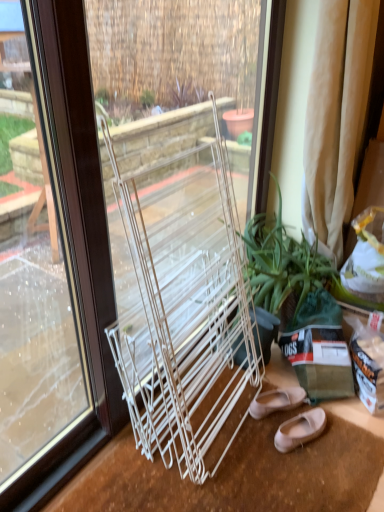
What do you see at coordinates (277, 401) in the screenshot? I see `matte beige flats at lower right, marked as the second footwear in a front-to-back arrangement` at bounding box center [277, 401].

What do you see at coordinates (75, 114) in the screenshot? I see `clear glass window at center` at bounding box center [75, 114].

What is the approximate height of beige fabric curtain at right?

It is 3.28 feet.

At what (x,y) coordinates should I click in order to perform the action: click on beige fabric curtain at right. Please return your answer as a coordinate pair (x, y). This screenshot has width=384, height=512. Looking at the image, I should click on click(337, 115).

Locate an element on the screen. matte pink leather ballet flats at lower right, the 1th footwear in the front-to-back sequence is located at coordinates (300, 429).

In order to face green leafy plant at center, should I rotate leftwards or rightwards?

Turn right approximately 11.299 degrees to face it.

This screenshot has height=512, width=384. I want to click on matte beige flats at lower right, marked as the second footwear in a front-to-back arrangement, so click(x=277, y=401).

Is clear glass window at center far from matte beige flats at lower right, marked as the second footwear in a front-to-back arrangement?

They are positioned close to each other.

Which point is more distant from viewer, (51,90) or (282,407)?

Point (282,407)

Considering the positions of objects clear glass window at center and matte beige flats at lower right, arranged as the first footwear when viewed from the back, in the image provided, who is more to the right, clear glass window at center or matte beige flats at lower right, arranged as the first footwear when viewed from the back,?

Positioned to the right is matte beige flats at lower right, arranged as the first footwear when viewed from the back.

Image resolution: width=384 pixels, height=512 pixels. I want to click on window that appears on the left of matte beige flats at lower right, arranged as the first footwear when viewed from the back, so click(75, 114).

From a real-world perspective, between green leafy plant at center and clear glass window at center, who is vertically higher?

In real-world perspective, clear glass window at center is above.

Are green leafy plant at center and clear glass window at center located far from each other?

green leafy plant at center is near clear glass window at center, not far away.

Could you tell me if green leafy plant at center is turned towards clear glass window at center?

Yes, green leafy plant at center is oriented towards clear glass window at center.

Between beige fabric curtain at right and clear glass window at center, which one has smaller size?

Smaller between the two is beige fabric curtain at right.

Consider the image. Is beige fabric curtain at right not close to clear glass window at center?

Yes, beige fabric curtain at right and clear glass window at center are located far from each other.

Is beige fabric curtain at right spatially inside clear glass window at center, or outside of it?

beige fabric curtain at right is not enclosed by clear glass window at center.

From a real-world perspective, is matte beige flats at lower right, arranged as the first footwear when viewed from the back, located higher than matte pink leather ballet flats at lower right, the 1th footwear in the front-to-back sequence?

No, from a real-world perspective, matte beige flats at lower right, arranged as the first footwear when viewed from the back, is not on top of matte pink leather ballet flats at lower right, the 1th footwear in the front-to-back sequence.

Who is more distant, matte beige flats at lower right, marked as the second footwear in a front-to-back arrangement, or matte pink leather ballet flats at lower right, the 1th footwear in the front-to-back sequence?

matte beige flats at lower right, marked as the second footwear in a front-to-back arrangement, is further away from the camera.

Between matte beige flats at lower right, arranged as the first footwear when viewed from the back, and matte pink leather ballet flats at lower right, the 1th footwear in the front-to-back sequence, which one has larger width?

With larger width is matte pink leather ballet flats at lower right, the 1th footwear in the front-to-back sequence.

From the image's perspective, is matte beige flats at lower right, marked as the second footwear in a front-to-back arrangement, positioned above or below matte pink leather ballet flats at lower right, arranged as the second footwear when viewed from the back?

Clearly, from the image's perspective, matte beige flats at lower right, marked as the second footwear in a front-to-back arrangement, is above matte pink leather ballet flats at lower right, arranged as the second footwear when viewed from the back.

Which is correct: green leafy plant at center is inside beige fabric curtain at right, or outside of it?

green leafy plant at center is not enclosed by beige fabric curtain at right.

Is green leafy plant at center facing away from beige fabric curtain at right?

No, beige fabric curtain at right is not at the back of green leafy plant at center.

Based on their positions, is green leafy plant at center located to the left or right of beige fabric curtain at right?

green leafy plant at center is to the left of beige fabric curtain at right.

From the picture: Considering the relative positions of beige fabric curtain at right and matte pink leather ballet flats at lower right, arranged as the second footwear when viewed from the back, in the image provided, is beige fabric curtain at right to the right of matte pink leather ballet flats at lower right, arranged as the second footwear when viewed from the back, from the viewer's perspective?

Yes, beige fabric curtain at right is to the right of matte pink leather ballet flats at lower right, arranged as the second footwear when viewed from the back.

From the image's perspective, who appears lower, beige fabric curtain at right or matte pink leather ballet flats at lower right, the 1th footwear in the front-to-back sequence?

matte pink leather ballet flats at lower right, the 1th footwear in the front-to-back sequence, appears lower in the image.

Is beige fabric curtain at right positioned far away from matte pink leather ballet flats at lower right, the 1th footwear in the front-to-back sequence?

Absolutely, beige fabric curtain at right is distant from matte pink leather ballet flats at lower right, the 1th footwear in the front-to-back sequence.

Considering the positions of point (308, 181) and point (317, 408), is point (308, 181) closer or farther from the camera than point (317, 408)?

Point (308, 181) appears to be farther away from the viewer than point (317, 408).

From the image's perspective, which one is positioned lower, clear glass window at center or green leafy plant at center?

green leafy plant at center is shown below in the image.

Is clear glass window at center at the right side of green leafy plant at center?

No, clear glass window at center is not to the right of green leafy plant at center.

Looking at their sizes, would you say clear glass window at center is wider or thinner than green leafy plant at center?

In the image, clear glass window at center appears to be more narrow than green leafy plant at center.

Identify the location of the 2nd footwear behind when counting from the clear glass window at center. (277, 401).

The image size is (384, 512). What are the coordinates of `window in front of the green leafy plant at center` in the screenshot? It's located at (75, 114).

Considering their positions, is matte pink leather ballet flats at lower right, the 1th footwear in the front-to-back sequence, positioned closer to green leafy plant at center than clear glass window at center?

matte pink leather ballet flats at lower right, the 1th footwear in the front-to-back sequence.

Considering their positions, is beige fabric curtain at right positioned closer to clear glass window at center than matte beige flats at lower right, arranged as the first footwear when viewed from the back?

Among the two, matte beige flats at lower right, arranged as the first footwear when viewed from the back, is located nearer to clear glass window at center.

When comparing their distances from green leafy plant at center, does matte pink leather ballet flats at lower right, the 1th footwear in the front-to-back sequence, or matte beige flats at lower right, arranged as the first footwear when viewed from the back, seem further?

Based on the image, matte pink leather ballet flats at lower right, the 1th footwear in the front-to-back sequence, appears to be further to green leafy plant at center.

Consider the image. Considering their positions, is green leafy plant at center positioned closer to clear glass window at center than beige fabric curtain at right?

green leafy plant at center is closer to clear glass window at center.

Based on their spatial positions, is matte beige flats at lower right, arranged as the first footwear when viewed from the back, or green leafy plant at center closer to beige fabric curtain at right?

green leafy plant at center is positioned closer to the anchor beige fabric curtain at right.

Considering their positions, is green leafy plant at center positioned further to matte pink leather ballet flats at lower right, the 1th footwear in the front-to-back sequence, than matte beige flats at lower right, marked as the second footwear in a front-to-back arrangement?

green leafy plant at center.

Based on their spatial positions, is matte beige flats at lower right, marked as the second footwear in a front-to-back arrangement, or matte pink leather ballet flats at lower right, arranged as the second footwear when viewed from the back, further from green leafy plant at center?

Based on the image, matte pink leather ballet flats at lower right, arranged as the second footwear when viewed from the back, appears to be further to green leafy plant at center.

Considering their positions, is clear glass window at center positioned further to beige fabric curtain at right than matte pink leather ballet flats at lower right, arranged as the second footwear when viewed from the back?

Among the two, matte pink leather ballet flats at lower right, arranged as the second footwear when viewed from the back, is located further to beige fabric curtain at right.

Locate an element on the screen. The width and height of the screenshot is (384, 512). window between beige fabric curtain at right and matte pink leather ballet flats at lower right, the 1th footwear in the front-to-back sequence, in the vertical direction is located at coordinates (75, 114).

This screenshot has height=512, width=384. Identify the location of curtain positioned between clear glass window at center and green leafy plant at center from near to far. (337, 115).

Where is `houseplant between beige fabric curtain at right and matte beige flats at lower right, marked as the second footwear in a front-to-back arrangement, in the up-down direction`? The height and width of the screenshot is (512, 384). houseplant between beige fabric curtain at right and matte beige flats at lower right, marked as the second footwear in a front-to-back arrangement, in the up-down direction is located at coordinates (283, 267).

This screenshot has height=512, width=384. What are the coordinates of `houseplant between clear glass window at center and matte pink leather ballet flats at lower right, the 1th footwear in the front-to-back sequence, in the vertical direction` in the screenshot? It's located at (283, 267).